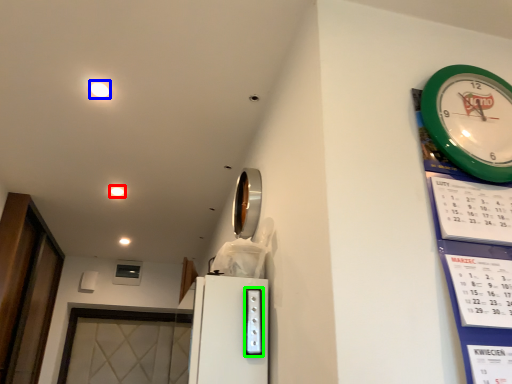
Question: Considering the real-world distances, which object is farthest from light (highlighted by a red box)? light (highlighted by a blue box) or appliance (highlighted by a green box)?

Choices:
 (A) light
 (B) appliance

Answer: (B)